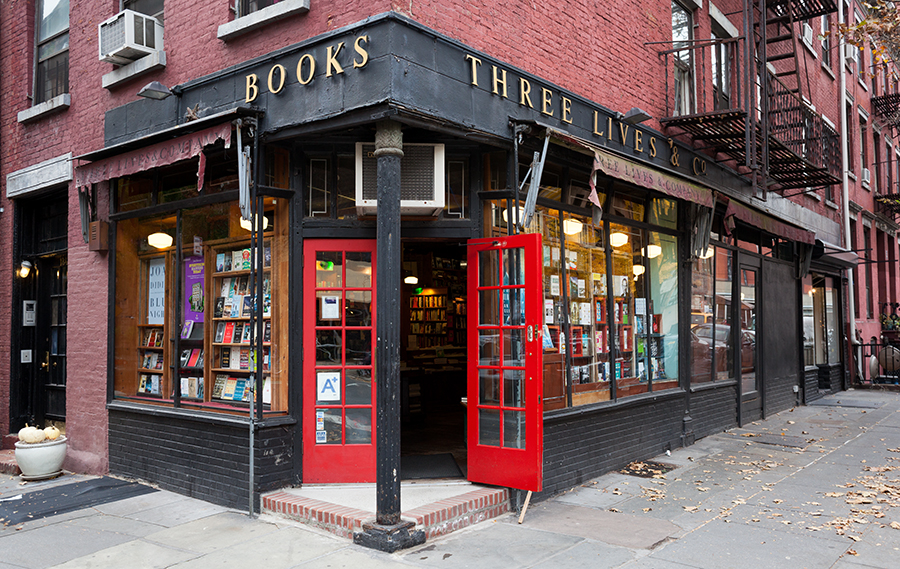
What are the coordinates of `window ledge` in the screenshot? It's located at (50, 111), (132, 76), (273, 18).